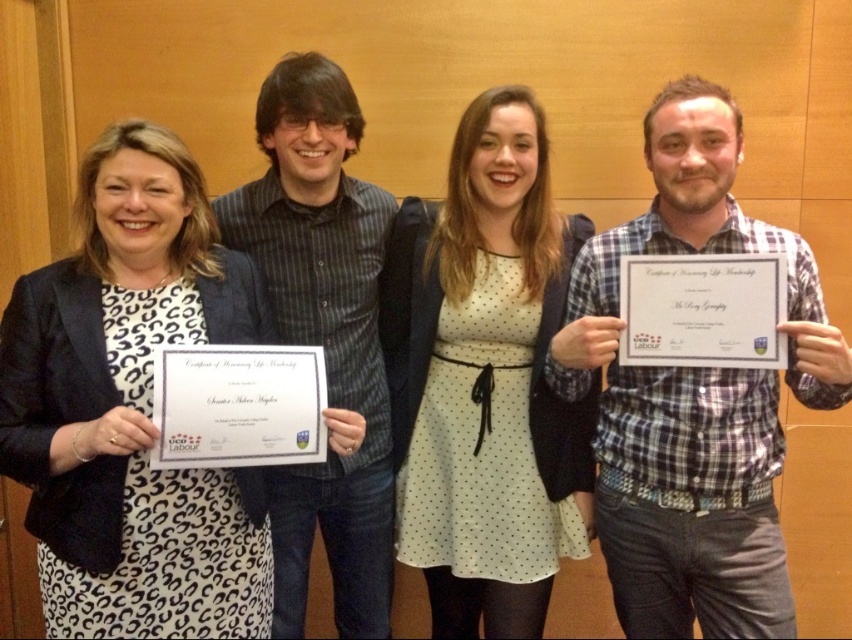
Is point (354, 616) positioned in front of point (320, 413)?

No, (354, 616) is further to viewer.

Image resolution: width=852 pixels, height=640 pixels. What do you see at coordinates (323, 333) in the screenshot? I see `striped shirt at center` at bounding box center [323, 333].

At what (x,y) coordinates should I click in order to perform the action: click on striped shirt at center. Please return your answer as a coordinate pair (x, y). This screenshot has height=640, width=852. Looking at the image, I should click on (323, 333).

Can you confirm if leopard print dress at center is positioned to the right of white paper certificate at right?

Incorrect, leopard print dress at center is not on the right side of white paper certificate at right.

Where is `leopard print dress at center`? The image size is (852, 640). leopard print dress at center is located at coordinates (131, 406).

Which is in front, point (484, 227) or point (360, 572)?

Point (484, 227) is in front.

The height and width of the screenshot is (640, 852). Find the location of `white dotted dress at center`. white dotted dress at center is located at coordinates (485, 380).